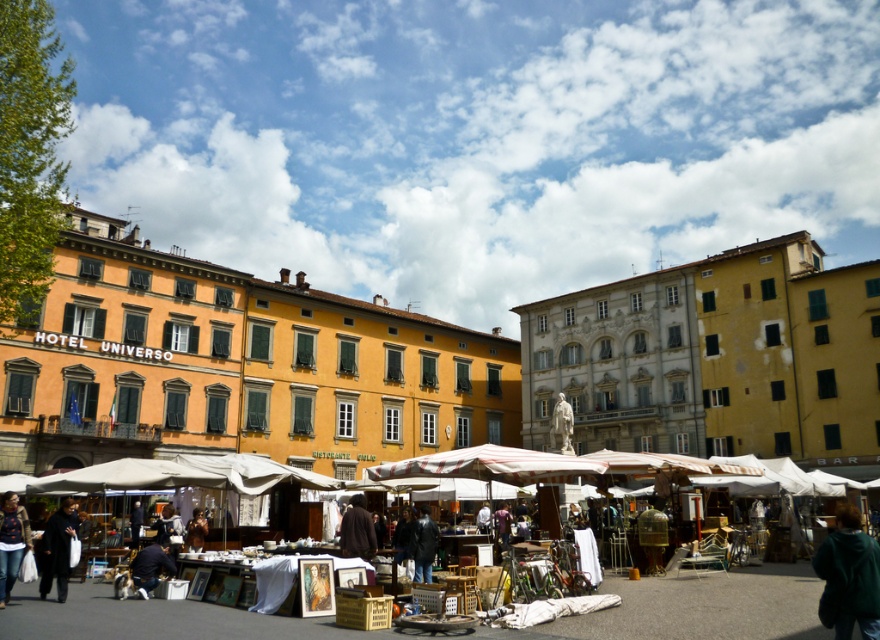
You are standing at the entrance of the market and want to locate two points marked in the image. The first point is at coordinates point (419, 557) and the second is at point (189, 520). Which of these two points is closer to you?

Point (419, 557) is in front of point (189, 520), so the first point is closer to you.

You are a customer at the flea market and want to buy a jacket. You have a small backpack and need to know which jacket is narrower to fit it in. Which jacket between the denim jacket at lower left and the dark blue leather jacket at center is narrower?

The denim jacket at lower left is narrower than the dark blue leather jacket at center, so it would fit better in your small backpack.